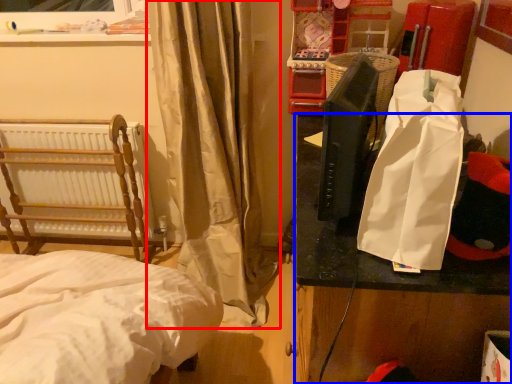
Question: Which object is closer to the camera taking this photo, curtain (highlighted by a red box) or table (highlighted by a blue box)?

Choices:
 (A) curtain
 (B) table

Answer: (B)